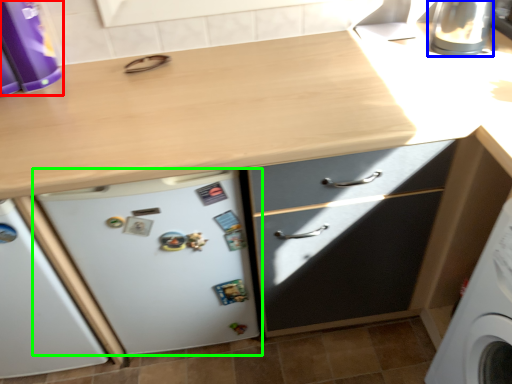
Question: Which is nearer to the kitchen appliance (highlighted by a red box)? appliance (highlighted by a blue box) or refrigerator (highlighted by a green box).

Choices:
 (A) appliance
 (B) refrigerator

Answer: (B)